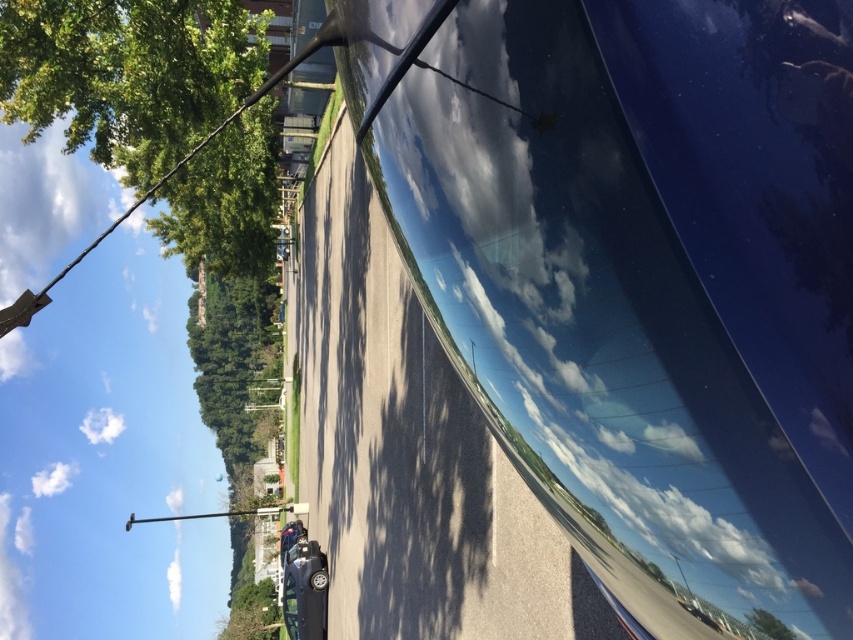
Question: Is glossy blue car at center to the left of green leafy tree at center from the viewer's perspective?

Choices:
 (A) no
 (B) yes

Answer: (A)

Question: Which point is closer to the camera taking this photo?

Choices:
 (A) pos(10,44)
 (B) pos(228,400)

Answer: (A)

Question: Which of the following is the farthest from the observer?

Choices:
 (A) (239, 282)
 (B) (207, 42)
 (C) (769, 67)

Answer: (A)

Question: Does glossy blue car at center appear over green leafy tree at upper left?

Choices:
 (A) no
 (B) yes

Answer: (A)

Question: Estimate the real-world distances between objects in this image. Which object is closer to the glossy blue car at center?

Choices:
 (A) green leafy tree at center
 (B) green leafy tree at upper left

Answer: (B)

Question: Does green leafy tree at upper left have a smaller size compared to green leafy tree at center?

Choices:
 (A) yes
 (B) no

Answer: (A)